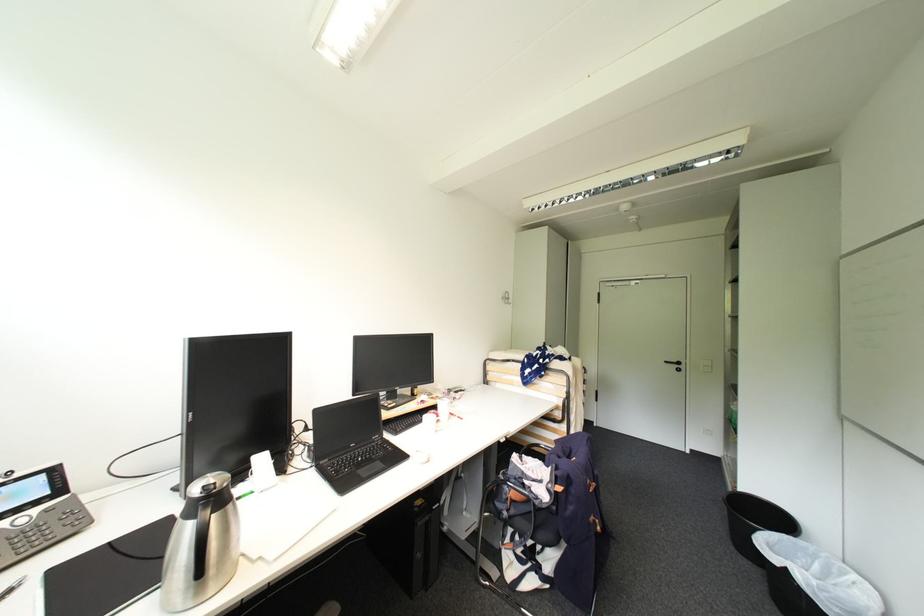
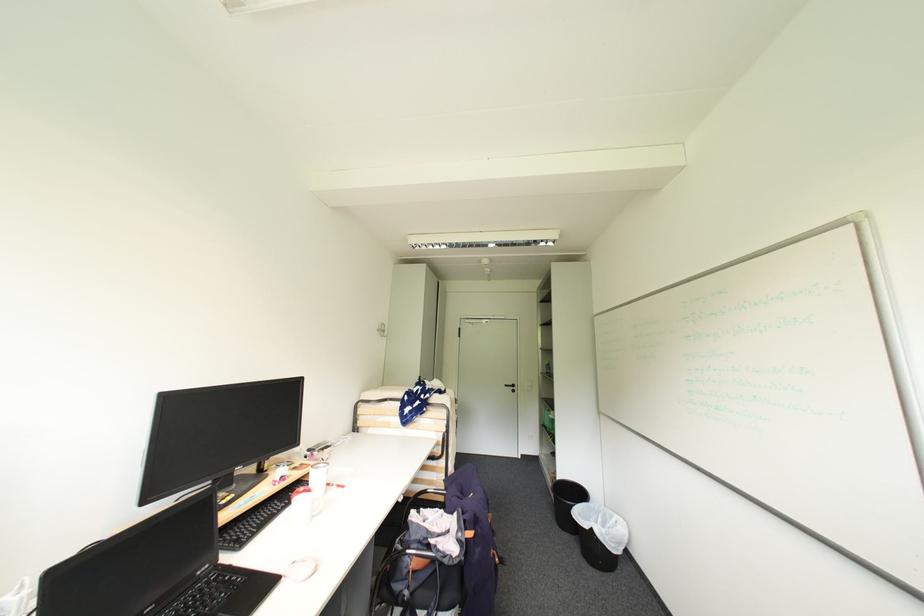
Where in the second image is the point corresponding to (673,363) from the first image?

(513, 387)